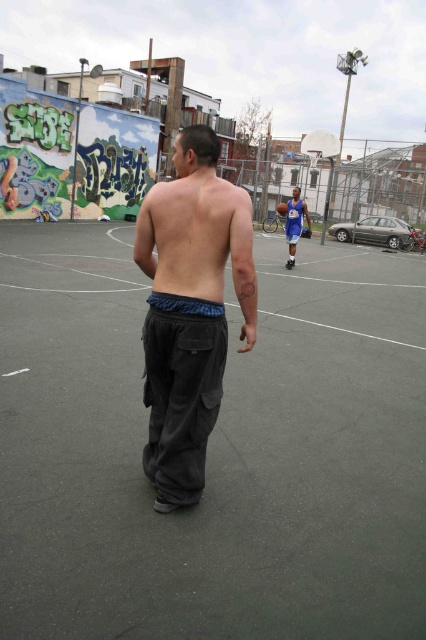
You are standing at the camera position observing the basketball court scene. There is a point marked at coordinates (x=198, y=230). What object is located at that point?

The point (x=198, y=230) marks dark gray cargo pants at center.

You are standing on the basketball court and see the dark gray cargo pants at center and the shiny blue basketball at center. Which object is nearer to you?

The dark gray cargo pants at center is closer to the viewer than the shiny blue basketball at center.